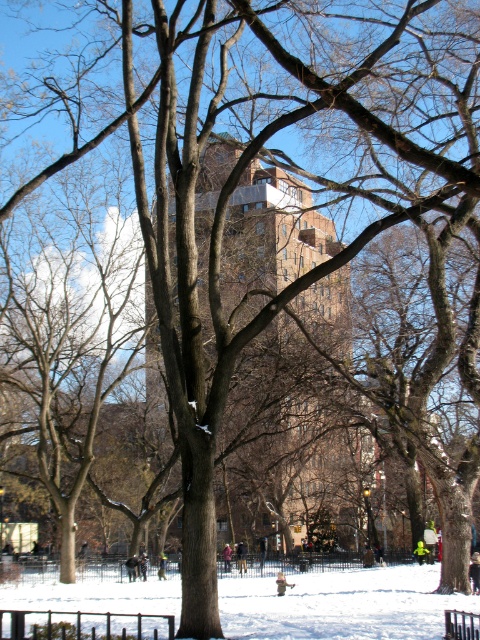
You are standing in the winter park scene. You want to take a photo of the brown brick building at center and the black metal bench at center. Which object should you focus on first if you want to capture both in the same frame without moving your camera?

The brown brick building at center is much taller than the black metal bench at center, so you should focus on the brown brick building at center first to ensure it fits entirely in the frame before adjusting for the bench.